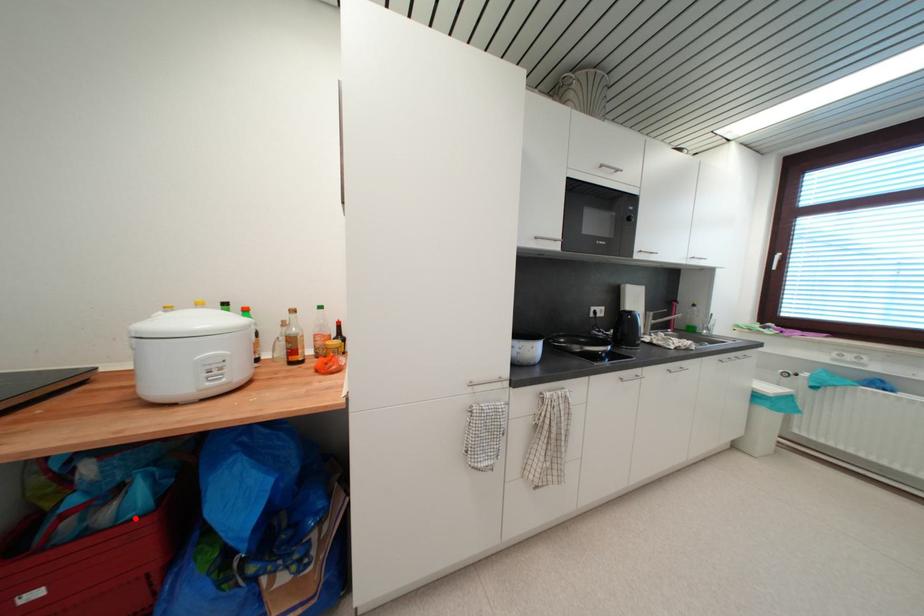
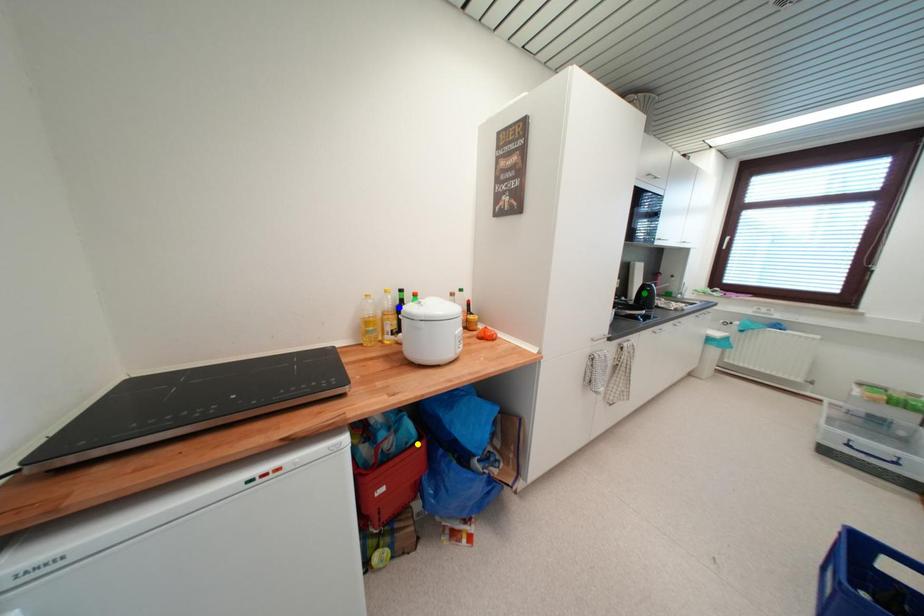
Question: I am providing you with two images of the same scene from different viewpoints. A red point is marked on the first image. You are given multiple points on the second image. Which point in image 2 represents the same 3d spot as the red point in image 1?

Choices:
 (A) green point
 (B) yellow point
 (C) blue point

Answer: (B)